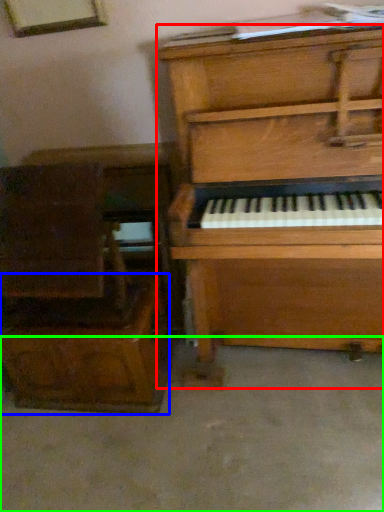
Question: Which is nearer to the piano (highlighted by a red box)? drawer (highlighted by a blue box) or concrete (highlighted by a green box).

Choices:
 (A) drawer
 (B) concrete

Answer: (A)